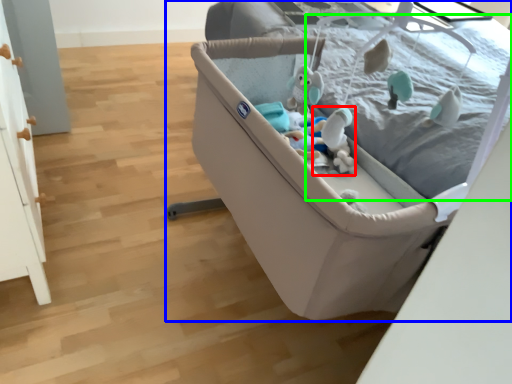
Question: Which object is the closest to the toy (highlighted by a red box)? Choose among these: infant bed (highlighted by a blue box) or mattress (highlighted by a green box).

Choices:
 (A) infant bed
 (B) mattress

Answer: (A)